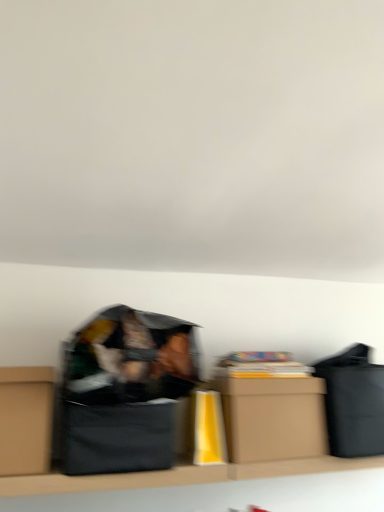
Question: Which direction should I rotate to look at brown cardboard box at center, the 2th box from the left?

Choices:
 (A) left
 (B) right

Answer: (B)

Question: Can you confirm if brown cardboard box at center, the 1th box viewed from the right, is positioned to the left of black cardboard box at center?

Choices:
 (A) no
 (B) yes

Answer: (A)

Question: Can you see brown cardboard box at center, the 1th box viewed from the right, touching black cardboard box at center?

Choices:
 (A) yes
 (B) no

Answer: (B)

Question: Is brown cardboard box at center, the 2th box from the left, facing away from black cardboard box at center?

Choices:
 (A) yes
 (B) no

Answer: (B)

Question: From the image's perspective, does brown cardboard box at center, the 2th box from the left, appear higher than black cardboard box at center?

Choices:
 (A) no
 (B) yes

Answer: (B)

Question: From the image's perspective, does brown cardboard box at center, the 2th box from the left, appear lower than black cardboard box at center?

Choices:
 (A) yes
 (B) no

Answer: (B)

Question: Considering the relative positions of brown cardboard box at center, the 2th box from the left, and brown cardboard box at left, which is the second box in right-to-left order, in the image provided, is brown cardboard box at center, the 2th box from the left, to the left of brown cardboard box at left, which is the second box in right-to-left order, from the viewer's perspective?

Choices:
 (A) no
 (B) yes

Answer: (A)

Question: Can you confirm if brown cardboard box at center, the 1th box viewed from the right, is taller than brown cardboard box at left, which is the second box in right-to-left order?

Choices:
 (A) no
 (B) yes

Answer: (A)

Question: Is brown cardboard box at center, the 1th box viewed from the right, far from brown cardboard box at left, which appears as the 1th box when viewed from the left?

Choices:
 (A) yes
 (B) no

Answer: (B)

Question: Is brown cardboard box at left, which appears as the 1th box when viewed from the left, completely or partially inside brown cardboard box at center, the 2th box from the left?

Choices:
 (A) no
 (B) yes

Answer: (A)

Question: Is brown cardboard box at center, the 2th box from the left, further to camera compared to brown cardboard box at left, which is the second box in right-to-left order?

Choices:
 (A) no
 (B) yes

Answer: (B)

Question: Can you confirm if brown cardboard box at center, the 2th box from the left, is smaller than brown cardboard box at left, which is the second box in right-to-left order?

Choices:
 (A) no
 (B) yes

Answer: (A)

Question: Does brown cardboard box at left, which is the second box in right-to-left order, have a smaller size compared to black cardboard box at center?

Choices:
 (A) no
 (B) yes

Answer: (B)